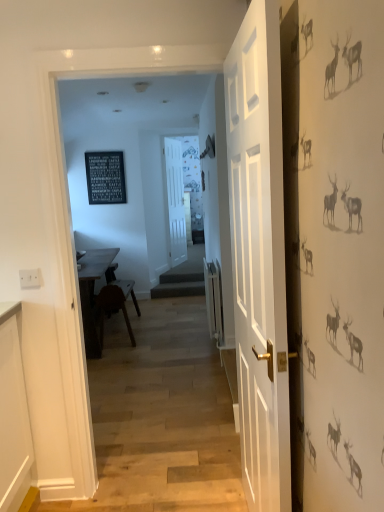
Find the location of a particular element. The width and height of the screenshot is (384, 512). white matte door at center, the 1th door in the back-to-front sequence is located at coordinates (175, 201).

From the image's perspective, is white matte door at center, arranged as the 2th door when viewed from the front, located beneath wooden table at center?

Actually, white matte door at center, arranged as the 2th door when viewed from the front, appears above wooden table at center in the image.

Consider the image. Is white matte door at center, arranged as the 2th door when viewed from the front, bigger or smaller than wooden table at center?

In the image, white matte door at center, arranged as the 2th door when viewed from the front, appears to be smaller than wooden table at center.

Image resolution: width=384 pixels, height=512 pixels. In order to click on table in front of the white matte door at center, arranged as the 2th door when viewed from the front in this screenshot , I will do pyautogui.click(x=93, y=292).

Is black slate sign at upper center touching wooden table at center?

No, black slate sign at upper center is not making contact with wooden table at center.

From the image's perspective, is black slate sign at upper center beneath wooden table at center?

Incorrect, from the image's perspective, black slate sign at upper center is higher than wooden table at center.

The width and height of the screenshot is (384, 512). What are the coordinates of `table below the black slate sign at upper center (from a real-world perspective)` in the screenshot? It's located at (93, 292).

Does black slate sign at upper center come in front of wooden table at center?

No, it is not.

This screenshot has width=384, height=512. Find the location of `the 2nd door positioned below the black slate sign at upper center (from a real-world perspective)`. the 2nd door positioned below the black slate sign at upper center (from a real-world perspective) is located at coordinates (259, 255).

Considering the relative positions of black slate sign at upper center and white wooden door at center, the first door from the right, in the image provided, is black slate sign at upper center behind white wooden door at center, the first door from the right,?

Yes, black slate sign at upper center is further from the viewer.

From the image's perspective, is black slate sign at upper center beneath white wooden door at center, the 2th door when ordered from back to front?

No, from the image's perspective, black slate sign at upper center is not below white wooden door at center, the 2th door when ordered from back to front.

Considering the sizes of black slate sign at upper center and white wooden door at center, arranged as the second door when viewed from the left, in the image, is black slate sign at upper center wider or thinner than white wooden door at center, arranged as the second door when viewed from the left,?

black slate sign at upper center is thinner than white wooden door at center, arranged as the second door when viewed from the left.

Are white matte door at center, the 2th door viewed from the right, and white wooden door at center, arranged as the second door when viewed from the left, beside each other?

No, white matte door at center, the 2th door viewed from the right, is not touching white wooden door at center, arranged as the second door when viewed from the left.

Which object is thinner, white matte door at center, the first door positioned from the left, or white wooden door at center, arranged as the second door when viewed from the left?

white wooden door at center, arranged as the second door when viewed from the left.

Could you tell me if white matte door at center, the first door positioned from the left, is facing white wooden door at center, which is the first door from front to back?

No, white matte door at center, the first door positioned from the left, is not aimed at white wooden door at center, which is the first door from front to back.

Is white matte door at center, arranged as the 2th door when viewed from the front, aimed at black slate sign at upper center?

No, white matte door at center, arranged as the 2th door when viewed from the front, is not aimed at black slate sign at upper center.

Is white matte door at center, the 1th door in the back-to-front sequence, in front of black slate sign at upper center?

No, white matte door at center, the 1th door in the back-to-front sequence, is further to the viewer.

From the image's perspective, who appears lower, white matte door at center, the 1th door in the back-to-front sequence, or black slate sign at upper center?

white matte door at center, the 1th door in the back-to-front sequence, appears lower in the image.

Which is closer to the camera, (x=175, y=185) or (x=98, y=185)?

Point (x=98, y=185)

Considering the relative sizes of wooden table at center and white matte door at center, the 1th door in the back-to-front sequence, in the image provided, is wooden table at center bigger than white matte door at center, the 1th door in the back-to-front sequence,?

Yes.

Considering the sizes of objects wooden table at center and white matte door at center, the first door positioned from the left, in the image provided, who is taller, wooden table at center or white matte door at center, the first door positioned from the left,?

white matte door at center, the first door positioned from the left.

I want to click on table located in front of the white matte door at center, the first door positioned from the left, so click(x=93, y=292).

Is wooden table at center thinner than white matte door at center, arranged as the 2th door when viewed from the front?

In fact, wooden table at center might be wider than white matte door at center, arranged as the 2th door when viewed from the front.

Can we say white wooden door at center, the first door from the right, lies outside white matte door at center, the first door positioned from the left?

That's correct, white wooden door at center, the first door from the right, is outside of white matte door at center, the first door positioned from the left.

Considering the sizes of white wooden door at center, the 2th door when ordered from back to front, and white matte door at center, the first door positioned from the left, in the image, is white wooden door at center, the 2th door when ordered from back to front, taller or shorter than white matte door at center, the first door positioned from the left,?

Considering their sizes, white wooden door at center, the 2th door when ordered from back to front, has more height than white matte door at center, the first door positioned from the left.

Relative to white matte door at center, the 2th door viewed from the right, is white wooden door at center, the 2th door when ordered from back to front, in front or behind?

In the image, white wooden door at center, the 2th door when ordered from back to front, appears in front of white matte door at center, the 2th door viewed from the right.

How much distance is there between white wooden door at center, which is the first door from front to back, and white matte door at center, the 2th door viewed from the right?

white wooden door at center, which is the first door from front to back, is 4.03 meters away from white matte door at center, the 2th door viewed from the right.

Locate an element on the screen. The width and height of the screenshot is (384, 512). table on the left of white matte door at center, the 2th door viewed from the right is located at coordinates (93, 292).

You are a GUI agent. You are given a task and a screenshot of the screen. Output one action in this format:
    pyautogui.click(x=<x>, y=<y>)
    Task: Click on the table in front of the black slate sign at upper center
    
    Given the screenshot: What is the action you would take?
    pyautogui.click(x=93, y=292)

From the image, which object appears to be farther from black slate sign at upper center, wooden table at center or white wooden door at center, arranged as the second door when viewed from the left?

white wooden door at center, arranged as the second door when viewed from the left, lies further to black slate sign at upper center than the other object.

When comparing their distances from wooden table at center, does black slate sign at upper center or white matte door at center, the 2th door viewed from the right, seem further?

white matte door at center, the 2th door viewed from the right, lies further to wooden table at center than the other object.

Estimate the real-world distances between objects in this image. Which object is closer to black slate sign at upper center, white wooden door at center, which is the first door from front to back, or white matte door at center, the 1th door in the back-to-front sequence?

Based on the image, white matte door at center, the 1th door in the back-to-front sequence, appears to be nearer to black slate sign at upper center.

Based on their spatial positions, is white matte door at center, the 1th door in the back-to-front sequence, or black slate sign at upper center further from white wooden door at center, the first door from the right?

white matte door at center, the 1th door in the back-to-front sequence, is positioned further to the anchor white wooden door at center, the first door from the right.

Considering their positions, is black slate sign at upper center positioned further to wooden table at center than white wooden door at center, which is the first door from front to back?

Based on the image, white wooden door at center, which is the first door from front to back, appears to be further to wooden table at center.

Estimate the real-world distances between objects in this image. Which object is closer to white matte door at center, arranged as the 2th door when viewed from the front, wooden table at center or white wooden door at center, the first door from the right?

wooden table at center.

Which object lies further to the anchor point white wooden door at center, which is the first door from front to back, black slate sign at upper center or wooden table at center?

Among the two, black slate sign at upper center is located further to white wooden door at center, which is the first door from front to back.

Based on their spatial positions, is wooden table at center or black slate sign at upper center closer to white wooden door at center, which is the first door from front to back?

Among the two, wooden table at center is located nearer to white wooden door at center, which is the first door from front to back.

The height and width of the screenshot is (512, 384). Identify the location of bulletin board between wooden table at center and white matte door at center, the 2th door viewed from the right, from front to back. (x=105, y=177).

Image resolution: width=384 pixels, height=512 pixels. In order to click on bulletin board located between white wooden door at center, which is the first door from front to back, and white matte door at center, the 2th door viewed from the right, in the depth direction in this screenshot , I will do `click(105, 177)`.

Where is `table located between white wooden door at center, which is the first door from front to back, and white matte door at center, the first door positioned from the left, in the depth direction`? The height and width of the screenshot is (512, 384). table located between white wooden door at center, which is the first door from front to back, and white matte door at center, the first door positioned from the left, in the depth direction is located at coordinates (93, 292).

Identify the location of table between white wooden door at center, which is the first door from front to back, and black slate sign at upper center in the front-back direction. This screenshot has width=384, height=512. (93, 292).